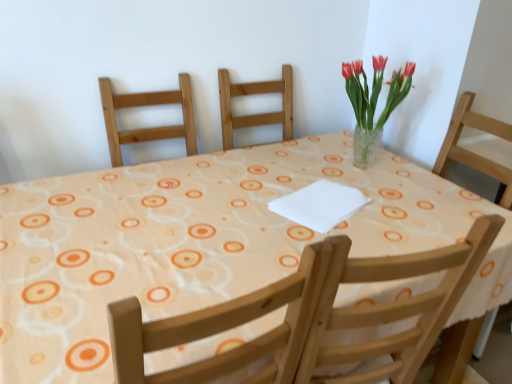
Describe the element at coordinates (373, 103) in the screenshot. I see `clear glass vase at upper right` at that location.

What do you see at coordinates (202, 243) in the screenshot? I see `white fabric at center` at bounding box center [202, 243].

What are the coordinates of `clear glass vase at upper right` in the screenshot? It's located at click(x=373, y=103).

In terms of height, does wooden chair at upper center look taller or shorter compared to clear glass vase at upper right?

In the image, wooden chair at upper center appears to be taller than clear glass vase at upper right.

From the image's perspective, is wooden chair at upper center located above clear glass vase at upper right?

Incorrect, from the image's perspective, wooden chair at upper center is lower than clear glass vase at upper right.

Considering the points (420, 364) and (372, 123), which point is behind, point (420, 364) or point (372, 123)?

The point (372, 123) is farther.

How different are the orientations of wooden chair at upper center and clear glass vase at upper right in degrees?

They differ by 0.659 degrees in their facing directions.

From a real-world perspective, is clear glass vase at upper right above or below wooden chair at upper center?

In terms of real-world spatial position, clear glass vase at upper right is above wooden chair at upper center.

Is clear glass vase at upper right not inside wooden chair at upper center?

Indeed, clear glass vase at upper right is completely outside wooden chair at upper center.

Is clear glass vase at upper right looking in the opposite direction of wooden chair at upper center?

No, wooden chair at upper center is not at the back of clear glass vase at upper right.

Is clear glass vase at upper right closer to camera compared to wooden chair at upper center?

No, clear glass vase at upper right is further to the viewer.

What's the angular difference between wooden chair at upper center and white fabric at center's facing directions?

There is a 88.5-degree angle between the facing directions of wooden chair at upper center and white fabric at center.

Considering the sizes of objects wooden chair at upper center and white fabric at center in the image provided, who is thinner, wooden chair at upper center or white fabric at center?

With smaller width is wooden chair at upper center.

Measure the distance between wooden chair at upper center and white fabric at center.

wooden chair at upper center and white fabric at center are 14.97 inches apart from each other.

Is wooden chair at upper center oriented towards white fabric at center?

Yes, wooden chair at upper center is turned towards white fabric at center.

Is white fabric at center directly adjacent to wooden chair at upper center?

They are not placed beside each other.

Can you tell me how much white fabric at center and wooden chair at upper center differ in facing direction?

88.5 degrees.

This screenshot has height=384, width=512. I want to click on chair that is under the white fabric at center (from a real-world perspective), so click(392, 306).

From the image's perspective, would you say white fabric at center is positioned over wooden chair at upper center?

No, from the image's perspective, white fabric at center is not above wooden chair at upper center.

In terms of size, does white fabric at center appear bigger or smaller than clear glass vase at upper right?

Considering their sizes, white fabric at center takes up more space than clear glass vase at upper right.

Is white fabric at center outside of clear glass vase at upper right?

That's correct, white fabric at center is outside of clear glass vase at upper right.

Does white fabric at center have a lesser height compared to clear glass vase at upper right?

No, white fabric at center is not shorter than clear glass vase at upper right.

Between point (192, 301) and point (361, 64), which one is positioned behind?

Positioned behind is point (361, 64).

How different are the orientations of clear glass vase at upper right and white fabric at center in degrees?

The angular difference between clear glass vase at upper right and white fabric at center is 87.9 degrees.

In terms of size, does clear glass vase at upper right appear bigger or smaller than white fabric at center?

In the image, clear glass vase at upper right appears to be smaller than white fabric at center.

Is clear glass vase at upper right wider than white fabric at center?

No.

Is point (369, 126) farther from viewer compared to point (209, 235)?

Yes, point (369, 126) is farther from viewer.

This screenshot has width=512, height=384. Find the location of `chair below the clear glass vase at upper right (from the image's perspective)`. chair below the clear glass vase at upper right (from the image's perspective) is located at coordinates (392, 306).

This screenshot has width=512, height=384. Identify the location of chair in front of the clear glass vase at upper right. (392, 306).

Estimate the real-world distances between objects in this image. Which object is closer to wooden chair at upper center, white fabric at center or clear glass vase at upper right?

Among the two, white fabric at center is located nearer to wooden chair at upper center.

From the image, which object appears to be nearer to wooden chair at upper center, clear glass vase at upper right or white fabric at center?

white fabric at center is closer to wooden chair at upper center.

From the image, which object appears to be farther from clear glass vase at upper right, white fabric at center or wooden chair at upper center?

wooden chair at upper center is further to clear glass vase at upper right.

Estimate the real-world distances between objects in this image. Which object is further from white fabric at center, wooden chair at upper center or clear glass vase at upper right?

The object further to white fabric at center is clear glass vase at upper right.

Which object lies further to the anchor point clear glass vase at upper right, wooden chair at upper center or white fabric at center?

wooden chair at upper center.

Which object lies nearer to the anchor point white fabric at center, clear glass vase at upper right or wooden chair at upper center?

The object closer to white fabric at center is wooden chair at upper center.

Identify the location of chair between white fabric at center and clear glass vase at upper right along the z-axis. The height and width of the screenshot is (384, 512). [392, 306].